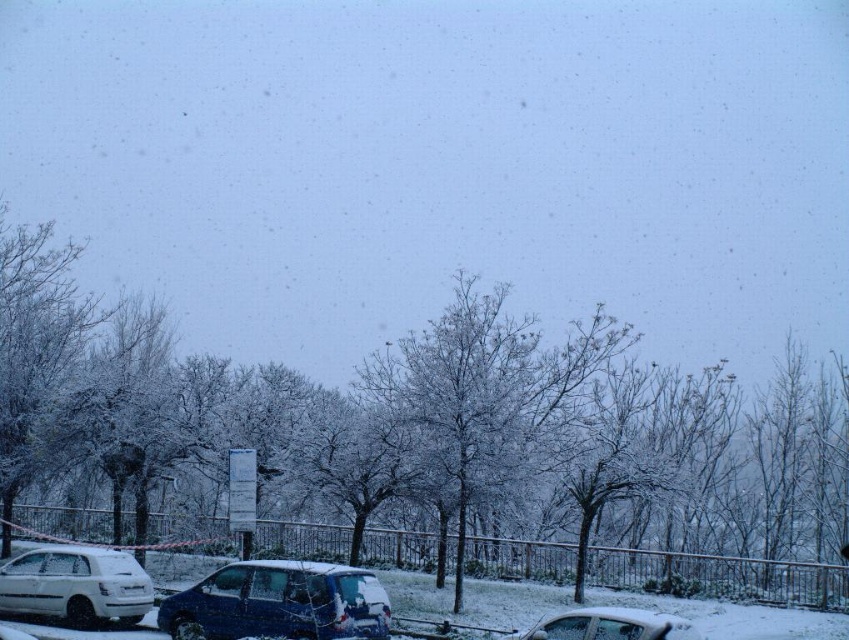
You are standing in the winter scene and want to move from the point at coordinates point (228, 579) to the point at coordinates point (127, 557). Which direction should you face to walk towards the second point?

Point (228, 579) is closer to the camera than point (127, 557). To move towards the point at (127, 557), you should face away from the camera direction, which would be towards the background of the scene.

You are standing at the edge of the snowy parking lot and want to walk towards the white matte hatchback at lower left. Will you pass by the sleek metallic van at center on your way there?

Yes, you will pass by the sleek metallic van at center on your way to the white matte hatchback at lower left because the sleek metallic van at center is closer to the viewer than the white matte hatchback at lower left.

You are standing at the point with coordinates point [279,602] in the winter scene. What object are you standing on?

You are standing on the sleek metallic van at center.